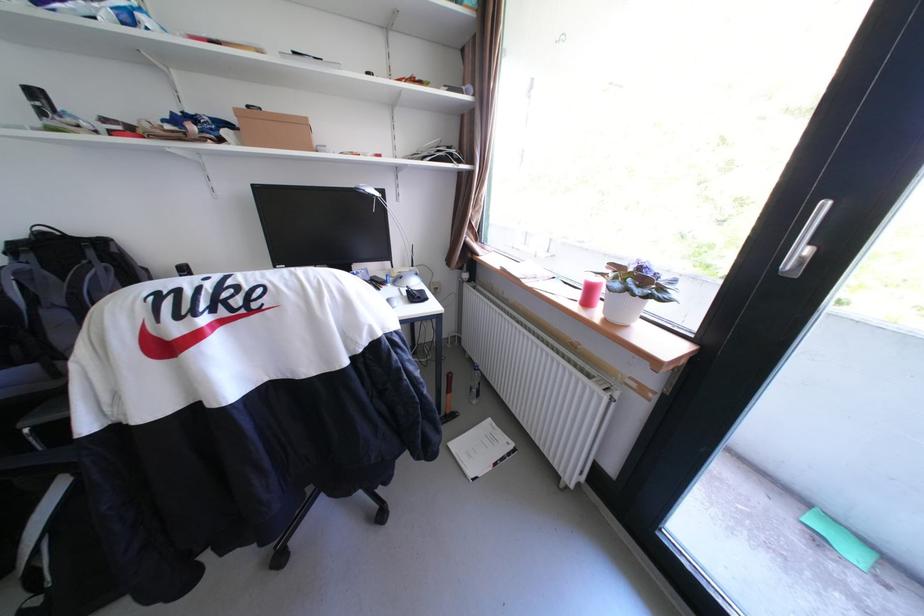
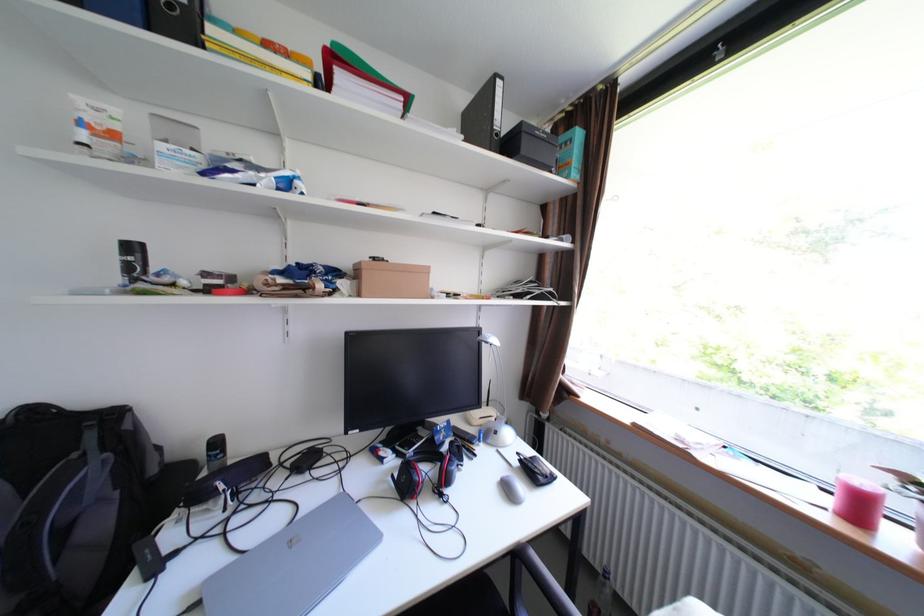
Question: Which direction would the cameraman need to move to produce the second image? Reply with the corresponding letter.

Choices:
 (A) Left
 (B) Right
 (C) Forward
 (D) Backward

Answer: (A)